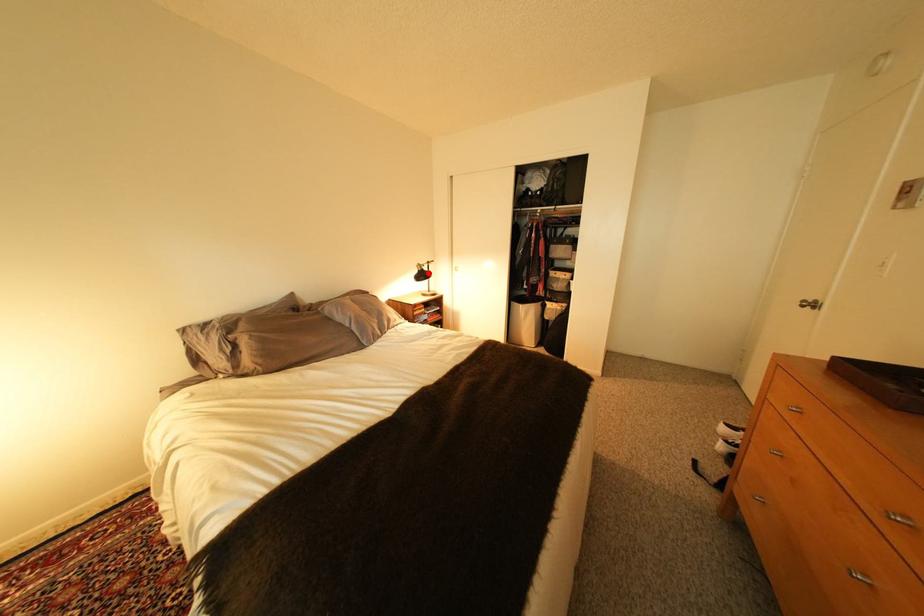
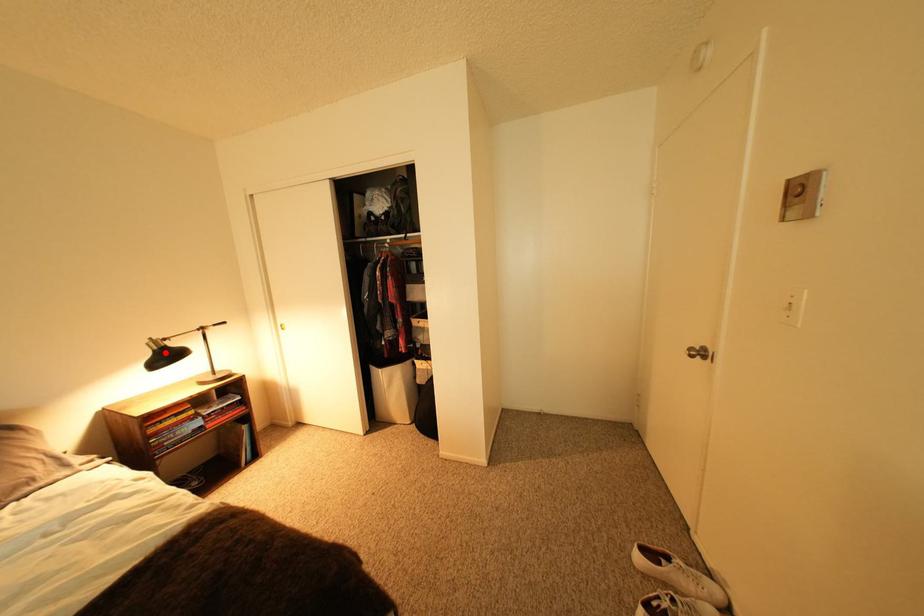
Consider the image. I am providing you with two images of the same scene from different viewpoints. A red point is marked on the first image and another point is marked on the second image. Is the red point in image1 aligned with the point shown in image2?

Yes